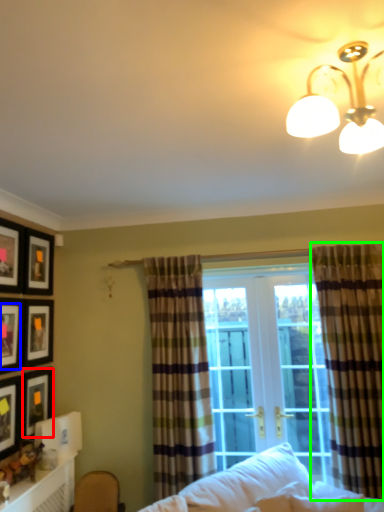
Question: Which object is the farthest from picture frame (highlighted by a red box)? Choose among these: picture frame (highlighted by a blue box) or curtain (highlighted by a green box).

Choices:
 (A) picture frame
 (B) curtain

Answer: (B)